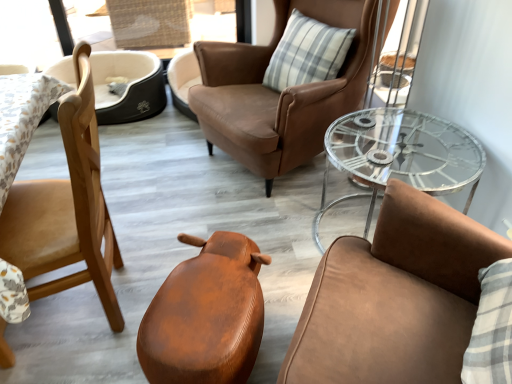
Locate an element on the screen. This screenshot has height=384, width=512. light brown wood chair at left, acting as the second chair starting from the left is located at coordinates (66, 208).

What do you see at coordinates (66, 208) in the screenshot? I see `light brown wood chair at left, which ranks as the fourth chair in right-to-left order` at bounding box center [66, 208].

What do you see at coordinates (206, 315) in the screenshot? The height and width of the screenshot is (384, 512). I see `leather-like brown stool at center, acting as the third chair starting from the right` at bounding box center [206, 315].

What do you see at coordinates (128, 86) in the screenshot? Image resolution: width=512 pixels, height=384 pixels. I see `wooden chair at left, arranged as the fifth chair when viewed from the right` at bounding box center [128, 86].

Measure the distance between point (155,92) and camera.

2.88 meters.

The width and height of the screenshot is (512, 384). I want to click on light brown wood chair at left, acting as the second chair starting from the left, so click(x=66, y=208).

Considering the relative sizes of transparent glass table at right and wooden chair at left, arranged as the fifth chair when viewed from the right, in the image provided, is transparent glass table at right bigger than wooden chair at left, arranged as the fifth chair when viewed from the right,?

Yes, transparent glass table at right is bigger than wooden chair at left, arranged as the fifth chair when viewed from the right.

Relative to wooden chair at left, arranged as the fifth chair when viewed from the right, is transparent glass table at right in front or behind?

In the image, transparent glass table at right appears in front of wooden chair at left, arranged as the fifth chair when viewed from the right.

Identify the location of the 2nd chair directly beneath the transparent glass table at right (from a real-world perspective). (128, 86).

Can you tell me how much brown leather chair at center, which ranks as the 4th chair in left-to-right order, and leather chair at center, acting as the 5th chair starting from the left, differ in facing direction?

60 degrees.

Can you confirm if brown leather chair at center, arranged as the second chair when viewed from the right, is thinner than leather chair at center, acting as the 5th chair starting from the left?

No.

Between point (202, 108) and point (373, 302), which one is positioned in front?

Point (373, 302)

Considering the sizes of objects brown leather chair at center, arranged as the second chair when viewed from the right, and leather chair at center, arranged as the first chair when viewed from the right, in the image provided, who is smaller, brown leather chair at center, arranged as the second chair when viewed from the right, or leather chair at center, arranged as the first chair when viewed from the right,?

leather chair at center, arranged as the first chair when viewed from the right, is smaller.

From a real-world perspective, is transparent glass table at right physically below light brown wood chair at left, which ranks as the fourth chair in right-to-left order?

Indeed, from a real-world perspective, transparent glass table at right is positioned beneath light brown wood chair at left, which ranks as the fourth chair in right-to-left order.

Is transparent glass table at right looking in the opposite direction of light brown wood chair at left, acting as the second chair starting from the left?

No, transparent glass table at right's orientation is not away from light brown wood chair at left, acting as the second chair starting from the left.

Does point (394, 109) come farther from viewer compared to point (24, 275)?

Yes.

From the image's perspective, is transparent glass table at right positioned above or below light brown wood chair at left, acting as the second chair starting from the left?

transparent glass table at right is above light brown wood chair at left, acting as the second chair starting from the left.

Considering the points (308, 105) and (95, 92), which point is behind, point (308, 105) or point (95, 92)?

The point (308, 105) is farther from the camera.

Which of these two, brown leather chair at center, which ranks as the 4th chair in left-to-right order, or wooden chair at left, marked as the first chair in a left-to-right arrangement, stands shorter?

wooden chair at left, marked as the first chair in a left-to-right arrangement, is shorter.

From a real-world perspective, between brown leather chair at center, which ranks as the 4th chair in left-to-right order, and wooden chair at left, arranged as the fifth chair when viewed from the right, who is vertically lower?

From a 3D spatial view, wooden chair at left, arranged as the fifth chair when viewed from the right, is below.

What's the angular difference between transparent glass table at right and plaid fabric pillow at center's facing directions?

28.1 degrees separate the facing orientations of transparent glass table at right and plaid fabric pillow at center.

Considering the sizes of transparent glass table at right and plaid fabric pillow at center in the image, is transparent glass table at right wider or thinner than plaid fabric pillow at center?

Clearly, transparent glass table at right has more width compared to plaid fabric pillow at center.

Is transparent glass table at right next to plaid fabric pillow at center and touching it?

They are not placed beside each other.

From a real-world perspective, is transparent glass table at right above or below plaid fabric pillow at center?

Clearly, from a real-world perspective, transparent glass table at right is below plaid fabric pillow at center.

Does light brown wood chair at left, acting as the second chair starting from the left, have a greater width compared to leather chair at center, arranged as the first chair when viewed from the right?

No, light brown wood chair at left, acting as the second chair starting from the left, is not wider than leather chair at center, arranged as the first chair when viewed from the right.

How many degrees apart are the facing directions of light brown wood chair at left, which ranks as the fourth chair in right-to-left order, and leather chair at center, arranged as the first chair when viewed from the right?

The angle between the facing direction of light brown wood chair at left, which ranks as the fourth chair in right-to-left order, and the facing direction of leather chair at center, arranged as the first chair when viewed from the right, is 35.6 degrees.

Between light brown wood chair at left, acting as the second chair starting from the left, and leather chair at center, acting as the 5th chair starting from the left, which one appears on the right side from the viewer's perspective?

leather chair at center, acting as the 5th chair starting from the left.

From the image's perspective, which one is positioned lower, light brown wood chair at left, acting as the second chair starting from the left, or leather chair at center, acting as the 5th chair starting from the left?

leather chair at center, acting as the 5th chair starting from the left, is shown below in the image.

Based on their positions, is plaid fabric pillow at center located to the left or right of leather-like brown stool at center, the third chair in the left-to-right sequence?

From the image, it's evident that plaid fabric pillow at center is to the right of leather-like brown stool at center, the third chair in the left-to-right sequence.

In the scene shown: From a real-world perspective, between plaid fabric pillow at center and leather-like brown stool at center, the third chair in the left-to-right sequence, who is vertically higher?

From a 3D spatial view, plaid fabric pillow at center is above.

From the image's perspective, would you say plaid fabric pillow at center is shown under leather-like brown stool at center, acting as the third chair starting from the right?

No, from the image's perspective, plaid fabric pillow at center is not below leather-like brown stool at center, acting as the third chair starting from the right.

Could you measure the distance between plaid fabric pillow at center and leather-like brown stool at center, the third chair in the left-to-right sequence?

The distance of plaid fabric pillow at center from leather-like brown stool at center, the third chair in the left-to-right sequence, is 4.12 feet.

Locate an element on the screen. table that appears on the right of wooden chair at left, arranged as the fifth chair when viewed from the right is located at coordinates (400, 155).

Where is `the 3rd chair behind the leather chair at center, arranged as the first chair when viewed from the right, counting from the anchor's position`? the 3rd chair behind the leather chair at center, arranged as the first chair when viewed from the right, counting from the anchor's position is located at coordinates (279, 93).

When comparing their distances from transparent glass table at right, does leather-like brown stool at center, acting as the third chair starting from the right, or brown leather chair at center, arranged as the second chair when viewed from the right, seem further?

A: Based on the image, leather-like brown stool at center, acting as the third chair starting from the right, appears to be further to transparent glass table at right.

Which object lies nearer to the anchor point leather-like brown stool at center, acting as the third chair starting from the right, brown leather chair at center, which ranks as the 4th chair in left-to-right order, or wooden chair at left, marked as the first chair in a left-to-right arrangement?

brown leather chair at center, which ranks as the 4th chair in left-to-right order, is positioned closer to the anchor leather-like brown stool at center, acting as the third chair starting from the right.

From the picture: Estimate the real-world distances between objects in this image. Which object is closer to plaid fabric pillow at center, wooden chair at left, arranged as the fifth chair when viewed from the right, or light brown wood chair at left, acting as the second chair starting from the left?

Based on the image, wooden chair at left, arranged as the fifth chair when viewed from the right, appears to be nearer to plaid fabric pillow at center.

Based on their spatial positions, is wooden chair at left, marked as the first chair in a left-to-right arrangement, or plaid fabric pillow at center closer to brown leather chair at center, arranged as the second chair when viewed from the right?

Based on the image, plaid fabric pillow at center appears to be nearer to brown leather chair at center, arranged as the second chair when viewed from the right.

Considering their positions, is leather-like brown stool at center, the third chair in the left-to-right sequence, positioned closer to plaid fabric pillow at center than light brown wood chair at left, acting as the second chair starting from the left?

leather-like brown stool at center, the third chair in the left-to-right sequence.

Considering their positions, is leather-like brown stool at center, acting as the third chair starting from the right, positioned closer to brown leather chair at center, arranged as the second chair when viewed from the right, than wooden chair at left, marked as the first chair in a left-to-right arrangement?

Among the two, leather-like brown stool at center, acting as the third chair starting from the right, is located nearer to brown leather chair at center, arranged as the second chair when viewed from the right.

Based on their spatial positions, is transparent glass table at right or brown leather chair at center, arranged as the second chair when viewed from the right, further from leather-like brown stool at center, the third chair in the left-to-right sequence?

The object further to leather-like brown stool at center, the third chair in the left-to-right sequence, is brown leather chair at center, arranged as the second chair when viewed from the right.

Estimate the real-world distances between objects in this image. Which object is further from wooden chair at left, marked as the first chair in a left-to-right arrangement, brown leather chair at center, which ranks as the 4th chair in left-to-right order, or leather chair at center, acting as the 5th chair starting from the left?

leather chair at center, acting as the 5th chair starting from the left, is further to wooden chair at left, marked as the first chair in a left-to-right arrangement.

In order to click on chair between leather-like brown stool at center, the third chair in the left-to-right sequence, and wooden chair at left, arranged as the fifth chair when viewed from the right, along the z-axis in this screenshot , I will do `click(279, 93)`.

Locate an element on the screen. table located between leather chair at center, arranged as the first chair when viewed from the right, and brown leather chair at center, arranged as the second chair when viewed from the right, in the depth direction is located at coordinates (400, 155).

I want to click on pillow between leather chair at center, acting as the 5th chair starting from the left, and wooden chair at left, marked as the first chair in a left-to-right arrangement, in the front-back direction, so click(x=307, y=53).

Locate an element on the screen. Image resolution: width=512 pixels, height=384 pixels. pillow between leather-like brown stool at center, the third chair in the left-to-right sequence, and wooden chair at left, arranged as the fifth chair when viewed from the right, along the z-axis is located at coordinates (307, 53).